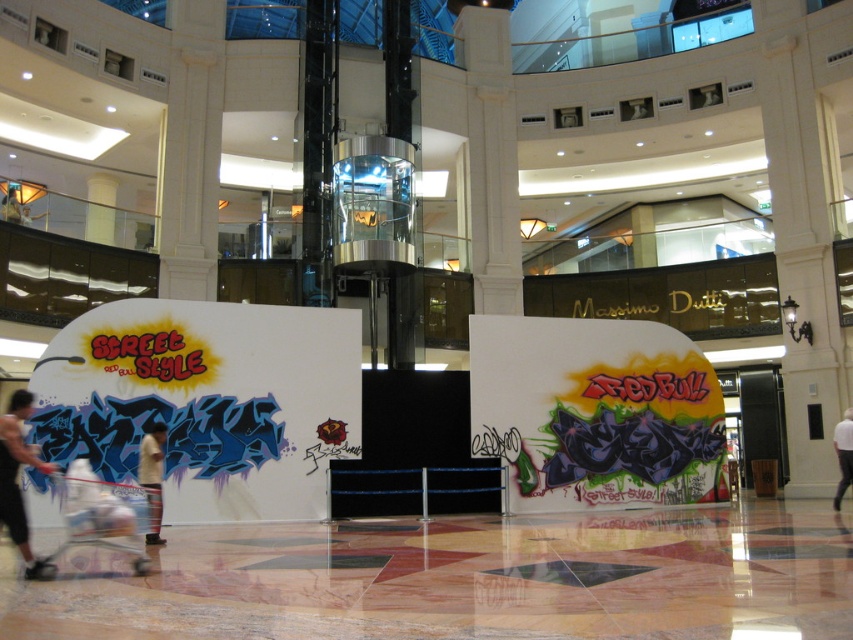
Does skinny jeans at lower left have a smaller size compared to white fabric at center?

No, skinny jeans at lower left is not smaller than white fabric at center.

How far apart are skinny jeans at lower left and white fabric at center?

skinny jeans at lower left and white fabric at center are 33.46 meters apart from each other.

Is point (0, 497) closer to camera compared to point (840, 493)?

That is True.

At what (x,y) coordinates should I click in order to perform the action: click on skinny jeans at lower left. Please return your answer as a coordinate pair (x, y). This screenshot has height=640, width=853. Looking at the image, I should click on (15, 477).

Between tan cotton shirt at center and white fabric at center, which one has less height?

tan cotton shirt at center is shorter.

Measure the distance from tan cotton shirt at center to white fabric at center.

tan cotton shirt at center and white fabric at center are 29.56 meters apart from each other.

Who is more distant from viewer, (144, 536) or (839, 422)?

The point (839, 422) is behind.

I want to click on tan cotton shirt at center, so click(152, 476).

Does white plastic baby carriage at lower left have a greater height compared to white fabric at center?

No, white plastic baby carriage at lower left is not taller than white fabric at center.

Between white plastic baby carriage at lower left and white fabric at center, which one has less height?

white plastic baby carriage at lower left

Who is more distant from viewer, (97, 504) or (842, 429)?

The point (842, 429) is behind.

At what (x,y) coordinates should I click in order to perform the action: click on white plastic baby carriage at lower left. Please return your answer as a coordinate pair (x, y). Looking at the image, I should click on (97, 515).